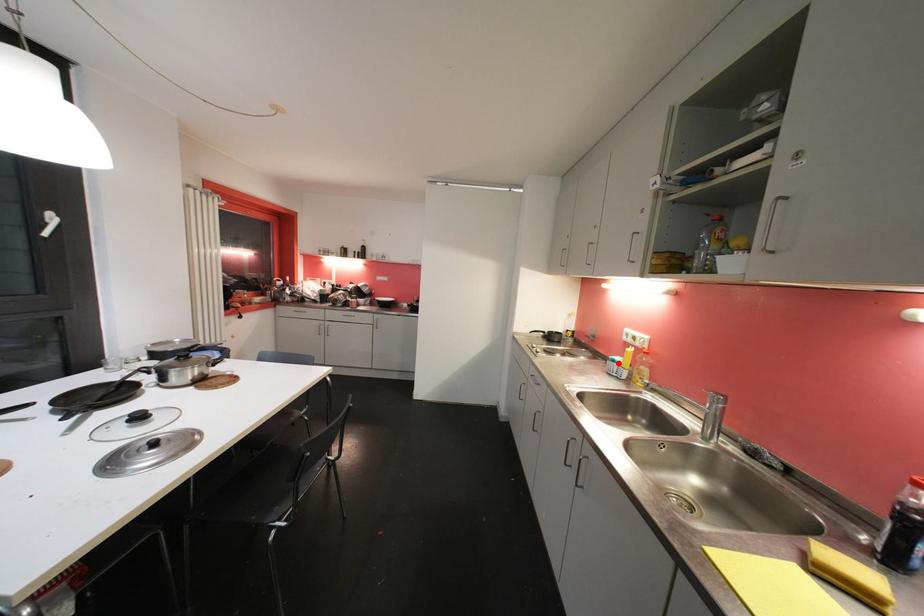
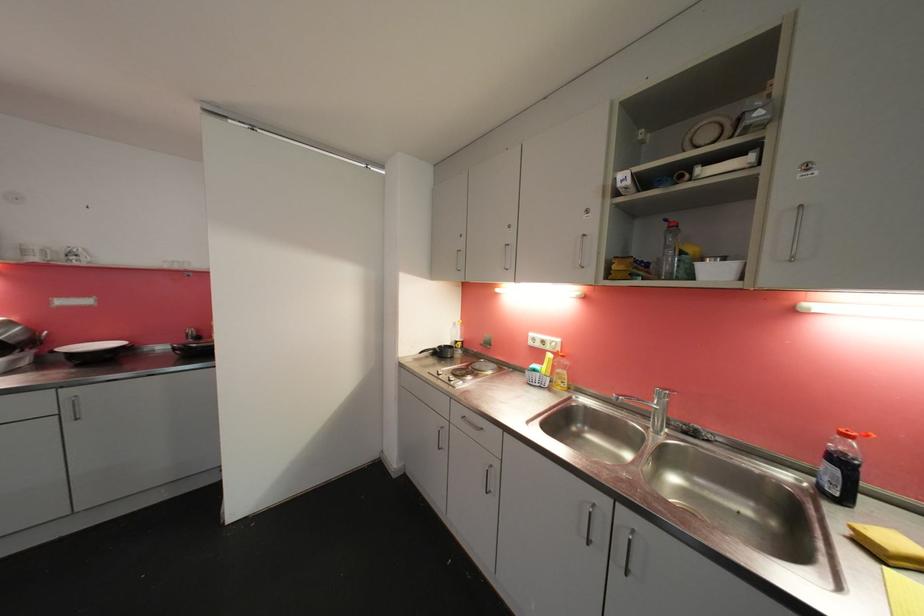
Find the pixel in the second image that matches the highlighted location in the first image.

(540, 373)